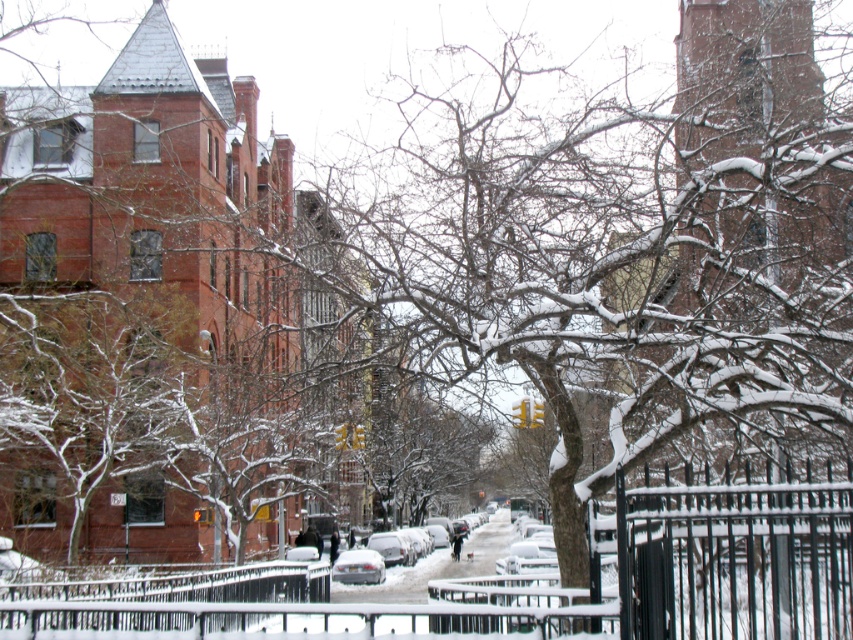
You are standing at the center of the image and want to locate the black metal fence at lower center. According to the coordinates provided, in which direction should you move to find it?

The black metal fence at lower center is located at point (163, 598). Since you are at the center, you should move downward and to the right to reach it.

You are a delivery person trying to navigate through the snow. You need to pass between the black metal fence at lower center and the silver metallic car at center. Can you fit through the space between them?

The black metal fence at lower center has a lesser width compared to the silver metallic car at center, so the space between them is narrow. However, since the fence is narrower, there might still be enough space for you to pass through if you move carefully.

You are standing on the sidewalk and want to see the black metal fence at lower center. Is the silver metallic car at center blocking your view of it?

The black metal fence at lower center is above the silver metallic car at center, so the car is not blocking the view of the fence.